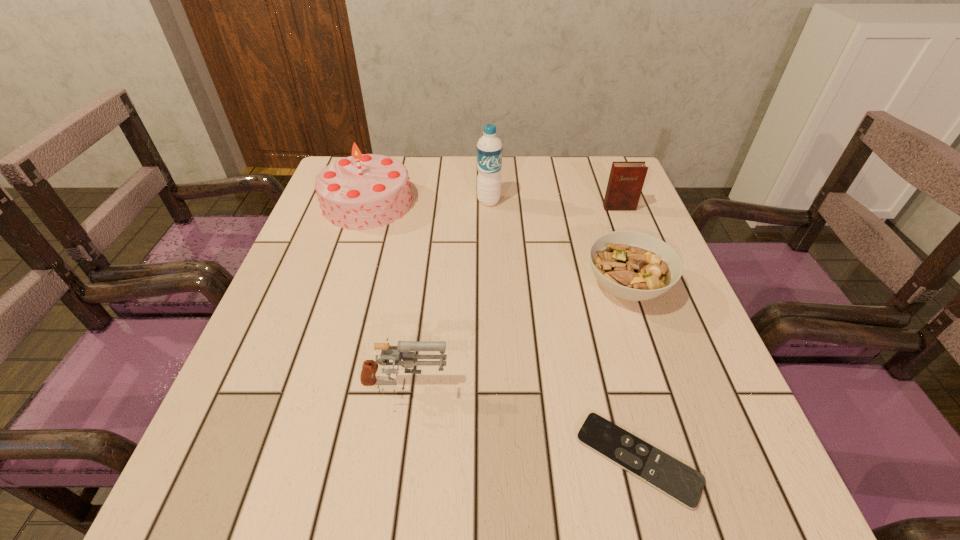
Find the location of a particular element. Image resolution: width=960 pixels, height=540 pixels. the tallest object is located at coordinates (489, 147).

Identify the location of the third object from left to right. The height and width of the screenshot is (540, 960). (489, 147).

I want to click on the second tallest object, so click(364, 191).

The height and width of the screenshot is (540, 960). What are the coordinates of `diary` in the screenshot? It's located at (x=626, y=180).

The width and height of the screenshot is (960, 540). In order to click on the fourth tallest object in this screenshot , I will do `click(403, 349)`.

I want to click on the fifth farthest object, so tap(403, 349).

In order to click on the fifth tallest object in this screenshot , I will do `click(631, 265)`.

Locate an element on the screen. The image size is (960, 540). the third nearest object is located at coordinates (631, 265).

Locate an element on the screen. The image size is (960, 540). remote control is located at coordinates (x=685, y=485).

This screenshot has width=960, height=540. Identify the location of the nearest object. (x=685, y=485).